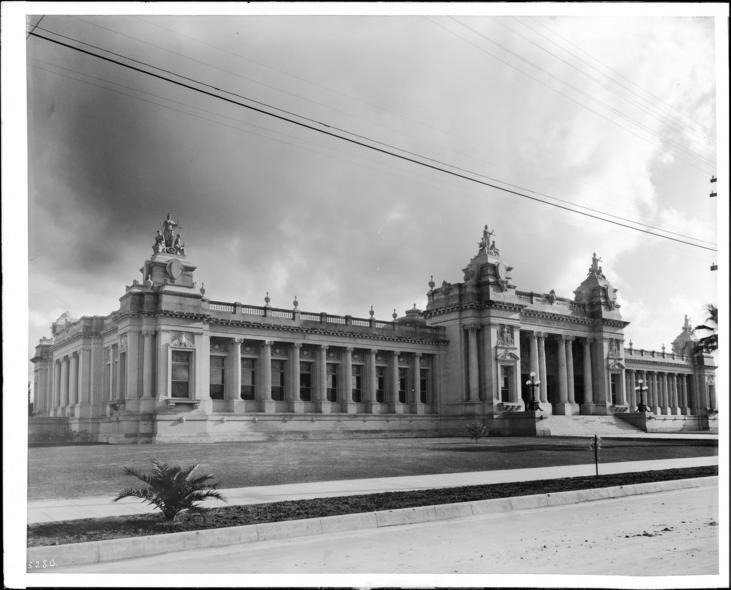
You are a GUI agent. You are given a task and a screenshot of the screen. Output one action in this format:
    pyautogui.click(x=<x>, y=<y>)
    Task: Click on the light fixtures
    Image resolution: width=731 pixels, height=590 pixels.
    Given the screenshot: What is the action you would take?
    pyautogui.click(x=531, y=378), pyautogui.click(x=640, y=385)